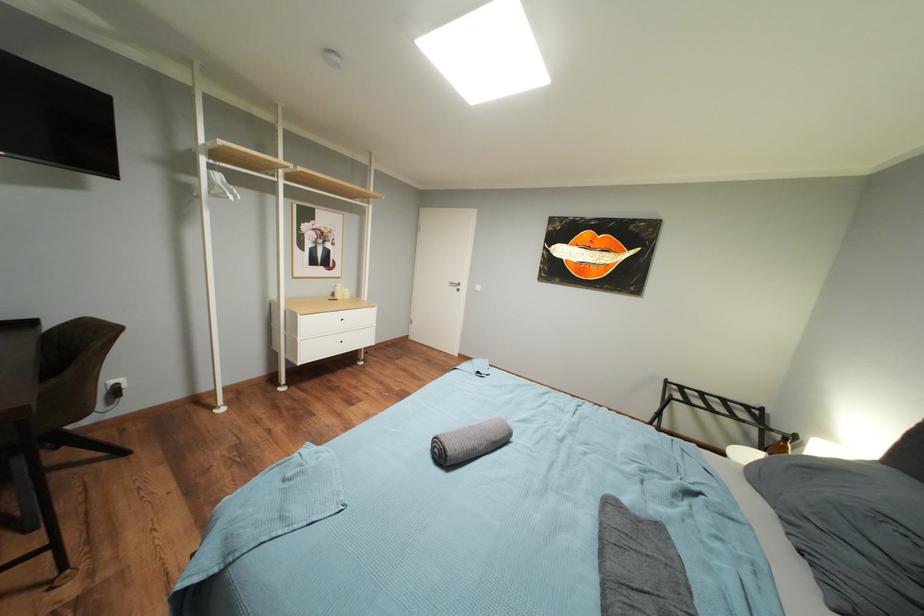
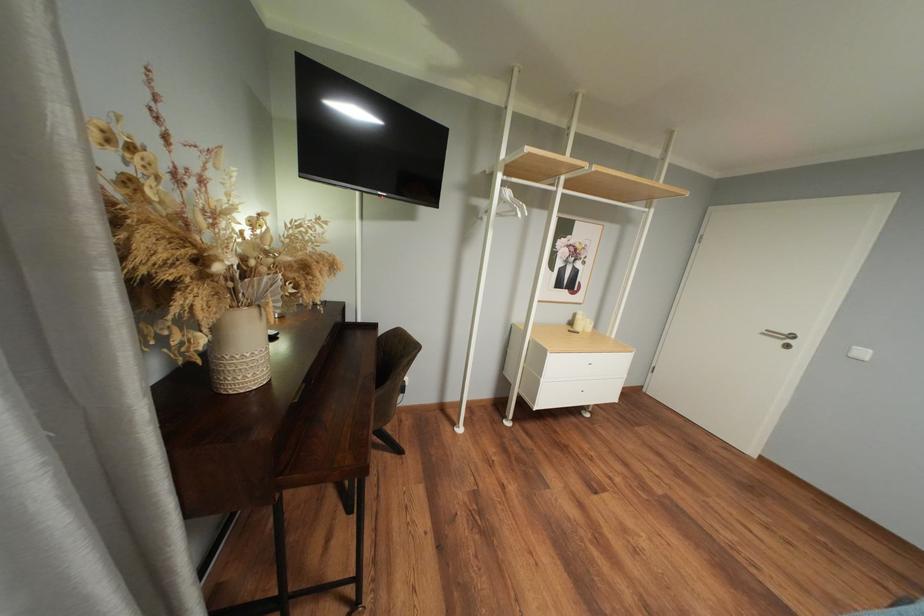
Question: The camera is either moving clockwise (left) or counter-clockwise (right) around the object. The first image is from the beginning of the video and the second image is from the end. Is the camera moving left or right when shooting the video?

Choices:
 (A) Left
 (B) Right

Answer: (B)